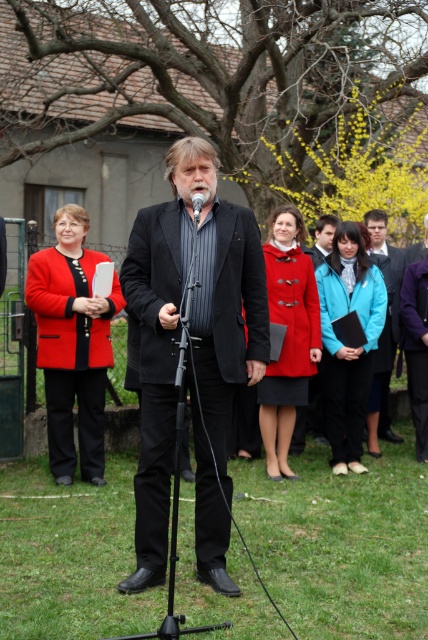
Can you confirm if blue fabric jacket at center is shorter than graywoollybeard at center?

In fact, blue fabric jacket at center may be taller than graywoollybeard at center.

Is point (394, 280) positioned before point (204, 202)?

No, it is not.

I want to click on blue fabric jacket at center, so click(383, 326).

Does matte red coat at left have a lesser width compared to black matte microphone at center?

No.

Between matte red coat at left and black matte microphone at center, which one has more height?

matte red coat at left is taller.

Which is behind, point (68, 358) or point (199, 204)?

Positioned behind is point (68, 358).

Locate an element on the screen. The image size is (428, 640). matte red coat at left is located at coordinates (73, 342).

Is matte black suit at center above black metal tripod at center?

Correct, matte black suit at center is located above black metal tripod at center.

You are a GUI agent. You are given a task and a screenshot of the screen. Output one action in this format:
    pyautogui.click(x=<x>, y=<y>)
    Task: Click on the matte black suit at center
    
    Given the screenshot: What is the action you would take?
    pyautogui.click(x=158, y=348)

Find the location of a particular element. The width and height of the screenshot is (428, 640). matte black suit at center is located at coordinates (158, 348).

Find the location of a particular element. This screenshot has height=640, width=428. matte black suit at center is located at coordinates (158, 348).